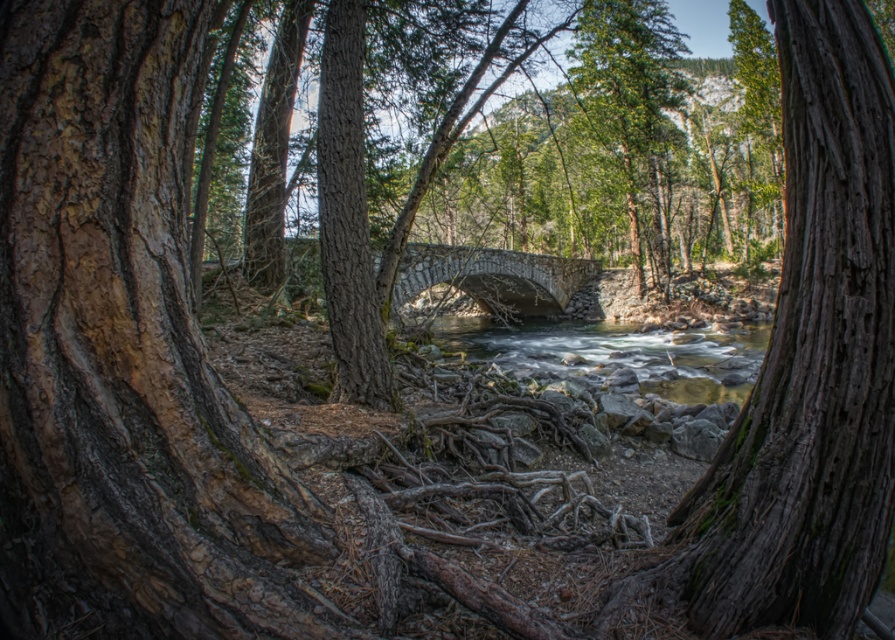
Question: Can you confirm if clear water at center is wider than stone bridge at center?

Choices:
 (A) no
 (B) yes

Answer: (B)

Question: Estimate the real-world distances between objects in this image. Which object is farther from the clear water at center?

Choices:
 (A) green matte tree at upper center
 (B) smooth brown tree trunk at center

Answer: (B)

Question: Which object is closer to the camera taking this photo?

Choices:
 (A) green matte tree at upper center
 (B) smooth brown tree trunk at center
 (C) clear water at center
 (D) stone bridge at center

Answer: (B)

Question: Which point is farther to the camera?

Choices:
 (A) (459, 330)
 (B) (479, 248)
 (C) (632, 179)

Answer: (A)

Question: Can you confirm if smooth brown tree trunk at center is bigger than clear water at center?

Choices:
 (A) no
 (B) yes

Answer: (A)

Question: Is smooth brown tree trunk at center wider than stone bridge at center?

Choices:
 (A) no
 (B) yes

Answer: (A)